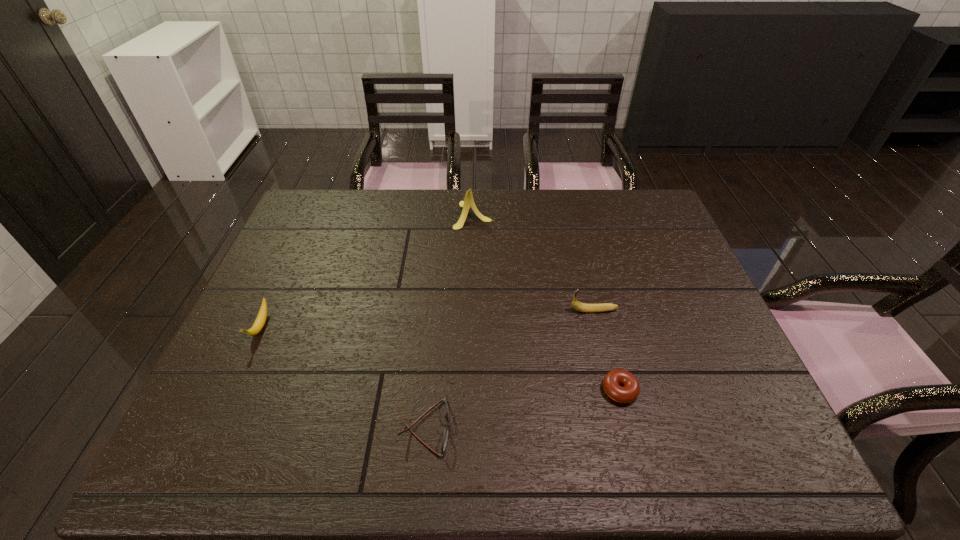
The image size is (960, 540). I want to click on free space located at the stem of the second tallest object, so click(x=426, y=310).

This screenshot has height=540, width=960. What are the coordinates of `vacant space located at the stem of the second tallest object` in the screenshot? It's located at (456, 310).

Image resolution: width=960 pixels, height=540 pixels. Find the location of `vacant point located 0.190m at the stem of the leftmost object`. vacant point located 0.190m at the stem of the leftmost object is located at coordinates (218, 420).

Identify the location of vacant space situated on the front-facing side of the spectacles. The image size is (960, 540). 598,427.

At what (x,y) coordinates should I click in order to perform the action: click on free space located on the back of the doughnut. Please return your answer as a coordinate pair (x, y). This screenshot has width=960, height=540. Looking at the image, I should click on (595, 294).

You are a GUI agent. You are given a task and a screenshot of the screen. Output one action in this format:
    pyautogui.click(x=<x>, y=<y>)
    Task: Click on the object that is at the far edge
    The width and height of the screenshot is (960, 540).
    Given the screenshot: What is the action you would take?
    pyautogui.click(x=468, y=202)

In order to click on object positioned at the near edge in this screenshot , I will do `click(446, 431)`.

You are a GUI agent. You are given a task and a screenshot of the screen. Output one action in this format:
    pyautogui.click(x=<x>, y=<y>)
    Task: Click on the object positioned at the left edge
    The height and width of the screenshot is (540, 960).
    Given the screenshot: What is the action you would take?
    pyautogui.click(x=262, y=315)

In the image, there is a desktop. Where is `blank space at the far edge`? Image resolution: width=960 pixels, height=540 pixels. blank space at the far edge is located at coordinates (434, 200).

Find the location of a particular element. The image size is (960, 540). free space at the near edge is located at coordinates (347, 471).